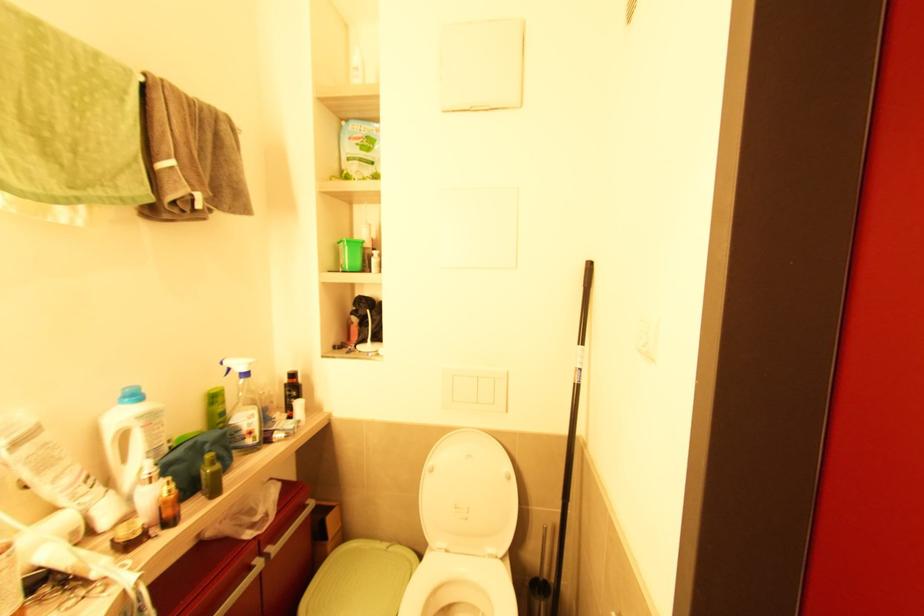
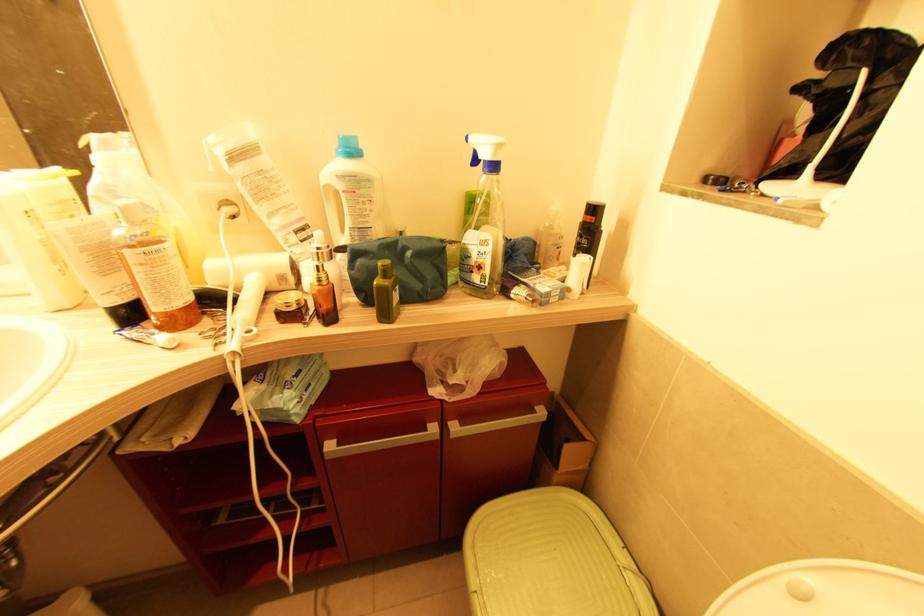
In the second image, find the point that corresponds to (x=209, y=447) in the first image.

(409, 254)